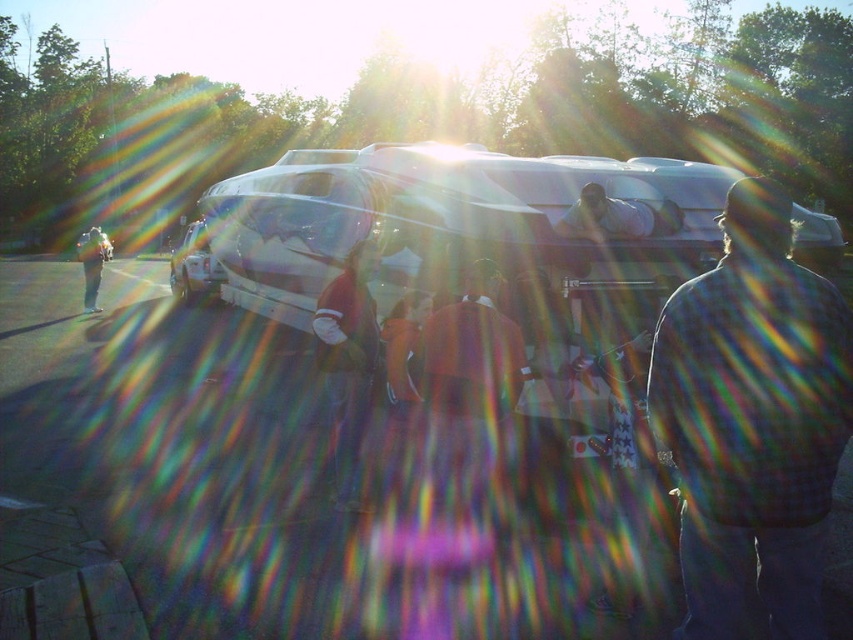
Question: Among these points, which one is farthest from the camera?

Choices:
 (A) (680, 216)
 (B) (337, 394)
 (C) (94, 228)
 (D) (496, 410)

Answer: (C)

Question: Which object is positioned farthest from the light brown leather jacket at left?

Choices:
 (A) matte gray shirt at center
 (B) plaid shirt at right
 (C) dark brown leather jacket at center
 (D) orange fabric jacket at center

Answer: (B)

Question: Is plaid shirt at right thinner than matte gray shirt at center?

Choices:
 (A) no
 (B) yes

Answer: (B)

Question: Is orange fabric jacket at center above light brown leather jacket at left?

Choices:
 (A) yes
 (B) no

Answer: (B)

Question: Estimate the real-world distances between objects in this image. Which object is closer to the plaid shirt at right?

Choices:
 (A) light brown leather jacket at left
 (B) orange fabric jacket at center

Answer: (B)

Question: Does matte gray shirt at center appear on the right side of light brown leather jacket at left?

Choices:
 (A) yes
 (B) no

Answer: (A)